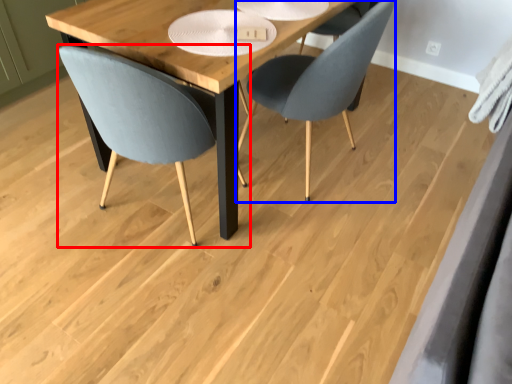
Question: Among these objects, which one is nearest to the camera, chair (highlighted by a red box) or chair (highlighted by a blue box)?

Choices:
 (A) chair
 (B) chair

Answer: (A)